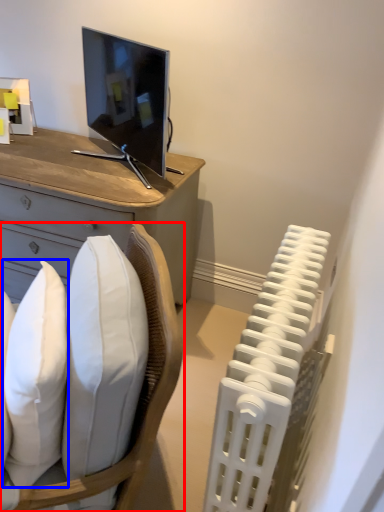
Question: Which of the following is the closest to the observer, chair (highlighted by a red box) or pillow (highlighted by a blue box)?

Choices:
 (A) chair
 (B) pillow

Answer: (A)